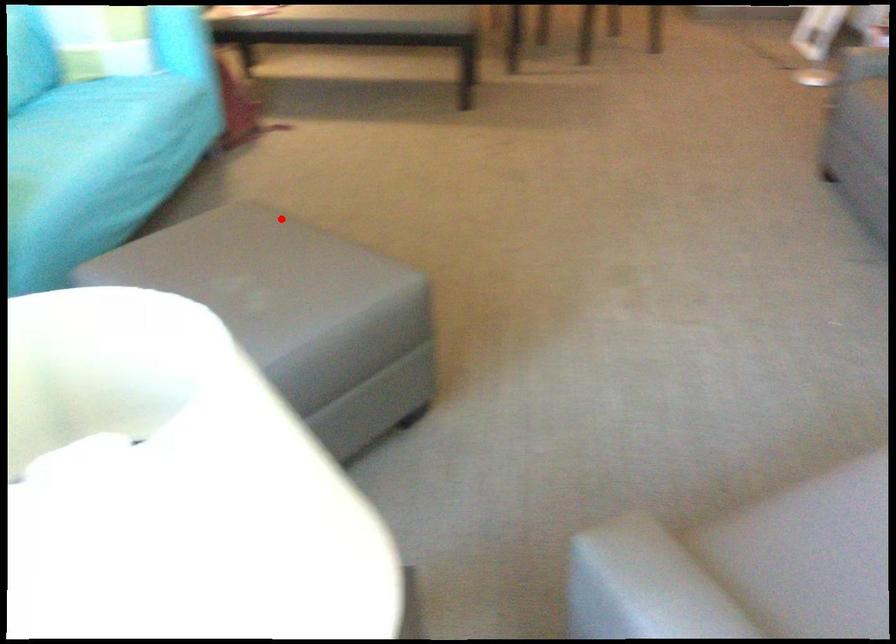
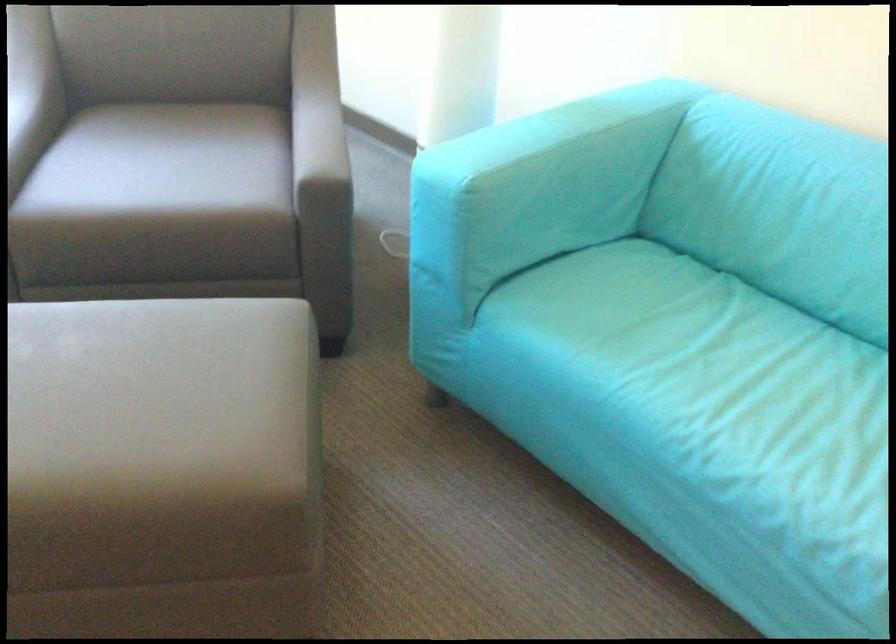
Question: I am providing you with two images of the same scene from different viewpoints. Given a red point in image1, look at the same physical point in image2. Is it:

Choices:
 (A) Closer to the viewpoint
 (B) Farther from the viewpoint

Answer: (A)